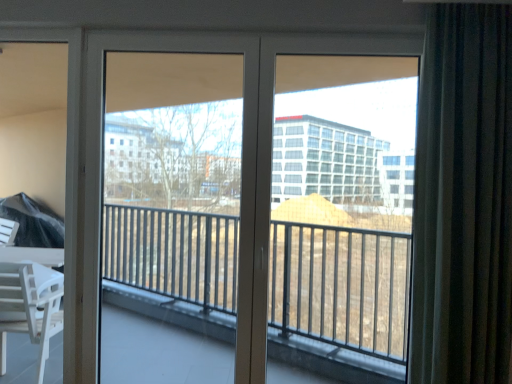
Question: Is dark gray textured curtain at right oriented towards white glossy door at center?

Choices:
 (A) yes
 (B) no

Answer: (B)

Question: Is dark gray textured curtain at right completely or partially outside of white glossy door at center?

Choices:
 (A) yes
 (B) no

Answer: (A)

Question: Is dark gray textured curtain at right further to the viewer compared to white glossy door at center?

Choices:
 (A) no
 (B) yes

Answer: (A)

Question: Would you say dark gray textured curtain at right is a long distance from white glossy door at center?

Choices:
 (A) yes
 (B) no

Answer: (B)

Question: Is dark gray textured curtain at right smaller than white glossy door at center?

Choices:
 (A) no
 (B) yes

Answer: (A)

Question: From a real-world perspective, is dark gray textured curtain at right positioned above or below white glossy door at center?

Choices:
 (A) below
 (B) above

Answer: (B)

Question: Is dark gray textured curtain at right inside or outside of white glossy door at center?

Choices:
 (A) outside
 (B) inside

Answer: (A)

Question: In terms of width, does dark gray textured curtain at right look wider or thinner when compared to white glossy door at center?

Choices:
 (A) thin
 (B) wide

Answer: (B)

Question: Considering the positions of point (420, 306) and point (129, 49), is point (420, 306) closer or farther from the camera than point (129, 49)?

Choices:
 (A) farther
 (B) closer

Answer: (B)

Question: Considering the positions of clear glass screen door at center and dark gray textured curtain at right in the image, is clear glass screen door at center wider or thinner than dark gray textured curtain at right?

Choices:
 (A) wide
 (B) thin

Answer: (B)

Question: In terms of height, does clear glass screen door at center look taller or shorter compared to dark gray textured curtain at right?

Choices:
 (A) tall
 (B) short

Answer: (A)

Question: Considering their positions, is clear glass screen door at center located in front of or behind dark gray textured curtain at right?

Choices:
 (A) behind
 (B) front

Answer: (A)

Question: Choose the correct answer: Is clear glass screen door at center inside dark gray textured curtain at right or outside it?

Choices:
 (A) inside
 (B) outside

Answer: (B)

Question: From the image's perspective, is white glossy door at center above or below transparent glass window at center?

Choices:
 (A) above
 (B) below

Answer: (A)

Question: Considering the relative positions of white glossy door at center and transparent glass window at center in the image provided, is white glossy door at center to the left or to the right of transparent glass window at center?

Choices:
 (A) right
 (B) left

Answer: (B)